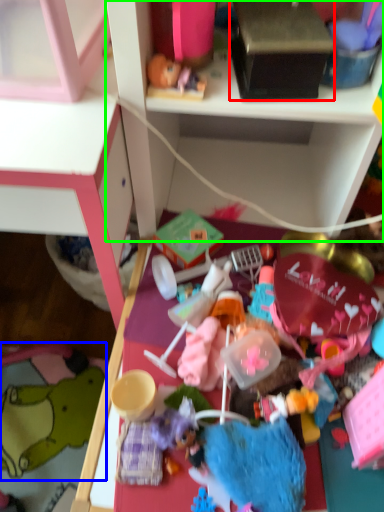
Question: Which object is positioned farthest from box (highlighted by a red box)? Select from toy (highlighted by a blue box) and shelf (highlighted by a green box).

Choices:
 (A) toy
 (B) shelf

Answer: (A)